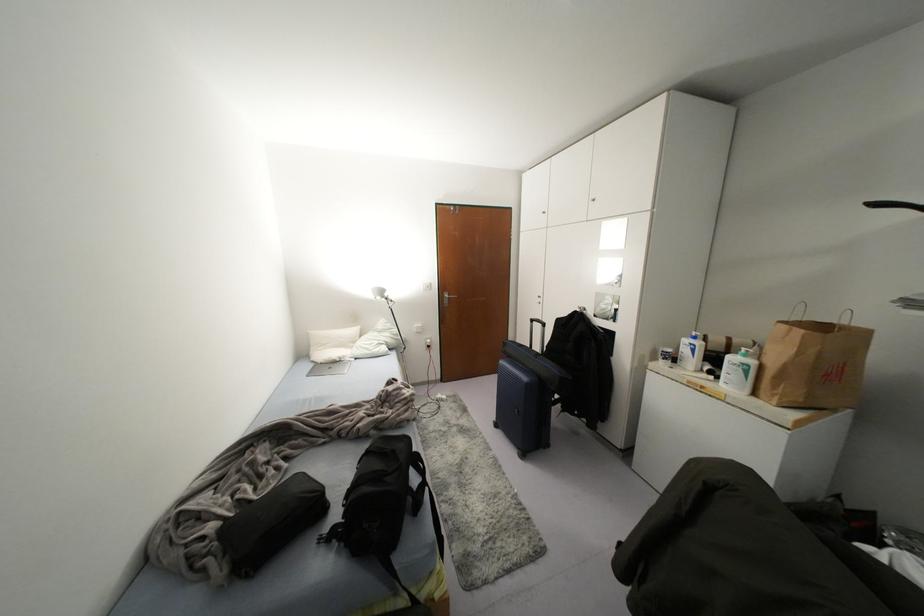
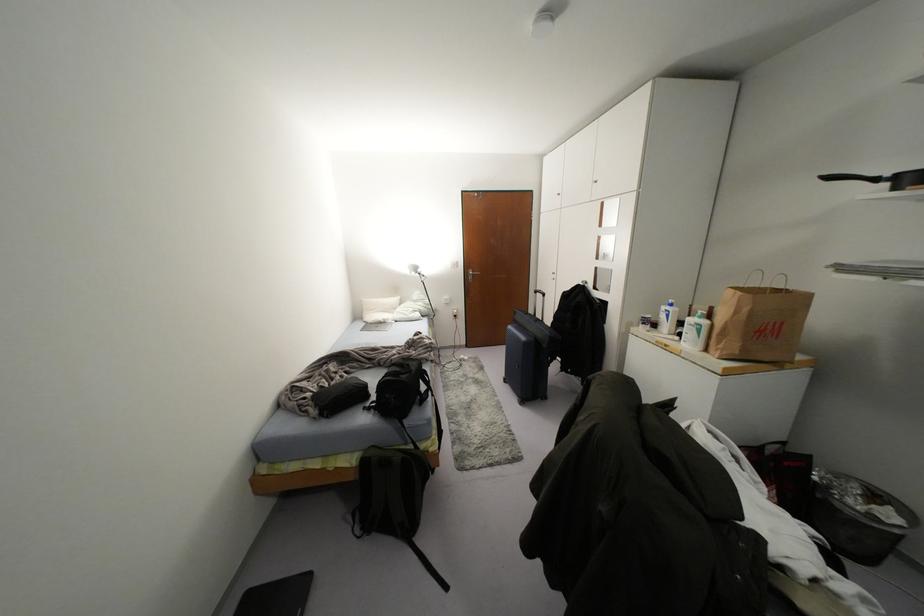
Question: The images are taken continuously from a first-person perspective. In which direction is your viewpoint rotating?

Choices:
 (A) Left
 (B) Right
 (C) Up
 (D) Down

Answer: (A)